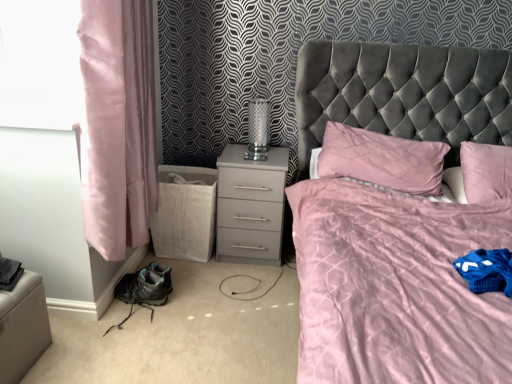
Question: Is velvet grey bed at center facing away from pink satin pillow at center?

Choices:
 (A) yes
 (B) no

Answer: (A)

Question: Does velvet grey bed at center appear on the right side of pink satin pillow at center?

Choices:
 (A) yes
 (B) no

Answer: (A)

Question: Is velvet grey bed at center further to the viewer compared to pink satin pillow at center?

Choices:
 (A) no
 (B) yes

Answer: (A)

Question: Is velvet grey bed at center surrounding pink satin pillow at center?

Choices:
 (A) no
 (B) yes

Answer: (B)

Question: From a real-world perspective, is velvet grey bed at center located beneath pink satin pillow at center?

Choices:
 (A) yes
 (B) no

Answer: (B)

Question: Visually, is clear glass table lamp at center positioned to the left or to the right of velvet grey bed at center?

Choices:
 (A) right
 (B) left

Answer: (B)

Question: From the image's perspective, is clear glass table lamp at center located above or below velvet grey bed at center?

Choices:
 (A) below
 (B) above

Answer: (B)

Question: From a real-world perspective, is clear glass table lamp at center above or below velvet grey bed at center?

Choices:
 (A) below
 (B) above

Answer: (B)

Question: In the image, is clear glass table lamp at center positioned in front of or behind velvet grey bed at center?

Choices:
 (A) front
 (B) behind

Answer: (B)

Question: Looking at their shapes, would you say velvet grey bed at center is wider or thinner than pink satin curtain at left?

Choices:
 (A) wide
 (B) thin

Answer: (A)

Question: From a real-world perspective, relative to pink satin curtain at left, is velvet grey bed at center vertically above or below?

Choices:
 (A) above
 (B) below

Answer: (B)

Question: Relative to pink satin curtain at left, is velvet grey bed at center in front or behind?

Choices:
 (A) behind
 (B) front

Answer: (B)

Question: Is velvet grey bed at center to the left or to the right of pink satin curtain at left in the image?

Choices:
 (A) left
 (B) right

Answer: (B)

Question: Looking at the image, does pink satin curtain at left seem bigger or smaller compared to clear glass table lamp at center?

Choices:
 (A) small
 (B) big

Answer: (B)

Question: From the image's perspective, is pink satin curtain at left positioned above or below clear glass table lamp at center?

Choices:
 (A) below
 (B) above

Answer: (A)